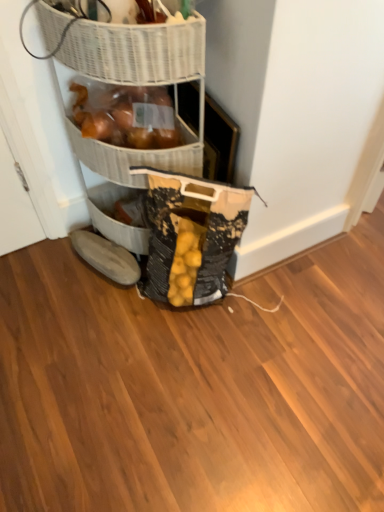
The height and width of the screenshot is (512, 384). I want to click on vacant area to the left of brown suede boot at lower left, so click(51, 274).